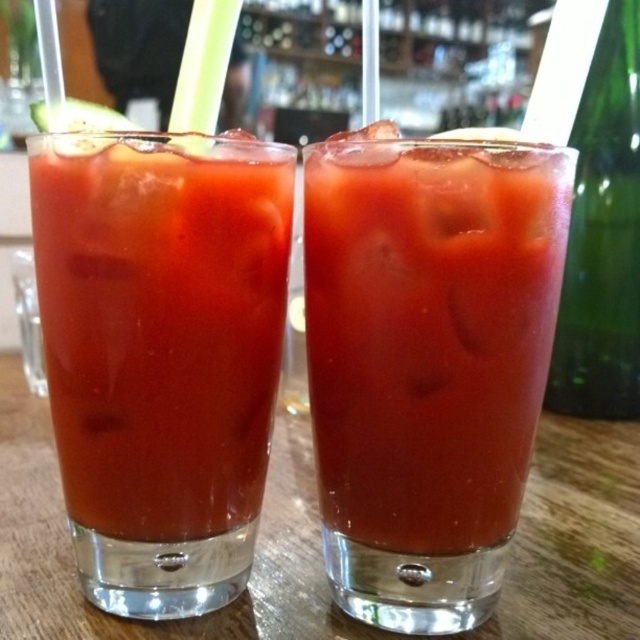
Between matte glass at center and green glass bottle at right, which one appears on the left side from the viewer's perspective?

From the viewer's perspective, matte glass at center appears more on the left side.

Which is below, matte glass at center or green glass bottle at right?

matte glass at center is lower down.

You are a GUI agent. You are given a task and a screenshot of the screen. Output one action in this format:
    pyautogui.click(x=<x>, y=<y>)
    Task: Click on the matte glass at center
    Image resolution: width=640 pixels, height=640 pixels.
    Given the screenshot: What is the action you would take?
    pyautogui.click(x=426, y=362)

Is the position of translucent glass at center less distant than that of green glass bottle at right?

Yes, it is in front of green glass bottle at right.

Who is more distant from viewer, (93, 147) or (628, 124)?

The point (628, 124) is more distant.

Is point (241, 330) positioned behind point (620, 310)?

No, it is in front of (620, 310).

Locate an element on the screen. translucent glass at center is located at coordinates (161, 324).

Can you confirm if matte glass at center is thinner than translucent glass at center?

No, matte glass at center is not thinner than translucent glass at center.

The height and width of the screenshot is (640, 640). In order to click on matte glass at center in this screenshot , I will do `click(426, 362)`.

Is point (392, 412) more distant than point (147, 332)?

Yes, it is behind point (147, 332).

Where is `matte glass at center`? This screenshot has width=640, height=640. matte glass at center is located at coordinates (426, 362).